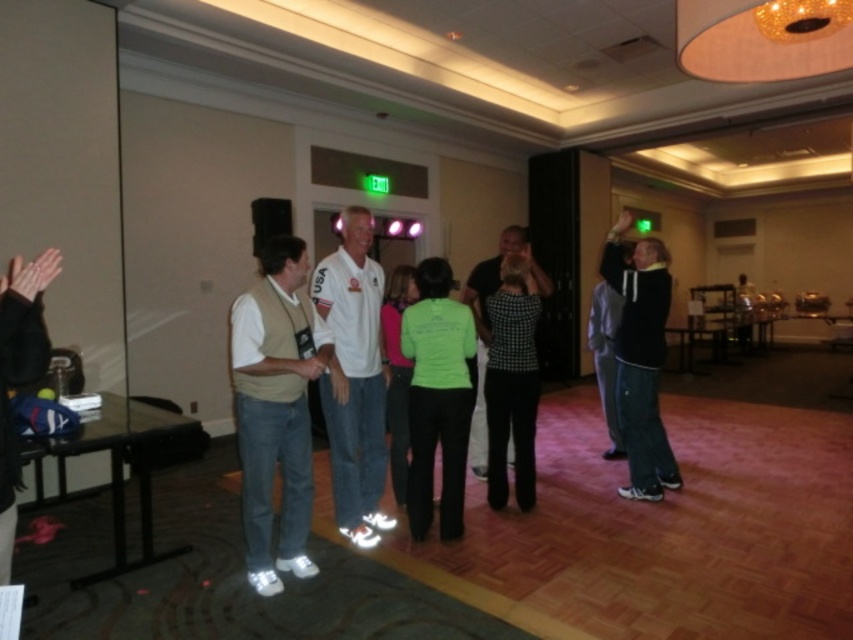
Measure the distance from light brown suede vest at center to white matte shirt at center.

37.26 centimeters

The image size is (853, 640). What are the coordinates of `light brown suede vest at center` in the screenshot? It's located at (276, 410).

Between white matte shirt at center and black leather jacket at left, which one is positioned higher?

Positioned higher is black leather jacket at left.

Can you confirm if white matte shirt at center is positioned to the left of black leather jacket at left?

Incorrect, white matte shirt at center is not on the left side of black leather jacket at left.

Does point (341, 387) come farther from viewer compared to point (4, 324)?

Yes, it is behind point (4, 324).

This screenshot has height=640, width=853. Identify the location of white matte shirt at center. (354, 378).

Identify the location of dark gray hoodie at right. (640, 360).